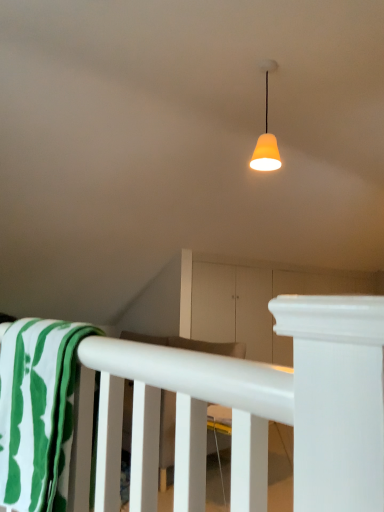
Question: Is white matte rail at lower center positioned behind green striped fabric at lower left?

Choices:
 (A) no
 (B) yes

Answer: (B)

Question: Considering the relative positions of white matte rail at lower center and green striped fabric at lower left in the image provided, is white matte rail at lower center to the left of green striped fabric at lower left from the viewer's perspective?

Choices:
 (A) no
 (B) yes

Answer: (A)

Question: Is white matte rail at lower center closer to camera compared to green striped fabric at lower left?

Choices:
 (A) no
 (B) yes

Answer: (A)

Question: From the image's perspective, is white matte rail at lower center on green striped fabric at lower left?

Choices:
 (A) no
 (B) yes

Answer: (A)

Question: Can you confirm if white matte rail at lower center is bigger than green striped fabric at lower left?

Choices:
 (A) no
 (B) yes

Answer: (B)

Question: Considering the positions of matte orange lampshade at upper center and green striped fabric at lower left in the image, is matte orange lampshade at upper center bigger or smaller than green striped fabric at lower left?

Choices:
 (A) small
 (B) big

Answer: (A)

Question: Relative to green striped fabric at lower left, is matte orange lampshade at upper center in front or behind?

Choices:
 (A) behind
 (B) front

Answer: (A)

Question: Is point (276, 155) closer or farther from the camera than point (49, 449)?

Choices:
 (A) farther
 (B) closer

Answer: (A)

Question: From a real-world perspective, is matte orange lampshade at upper center physically located above or below green striped fabric at lower left?

Choices:
 (A) above
 (B) below

Answer: (A)

Question: Is white matte rail at lower center wider or thinner than matte orange lampshade at upper center?

Choices:
 (A) wide
 (B) thin

Answer: (A)

Question: In the image, is white matte rail at lower center positioned in front of or behind matte orange lampshade at upper center?

Choices:
 (A) front
 (B) behind

Answer: (A)

Question: From their relative heights in the image, would you say white matte rail at lower center is taller or shorter than matte orange lampshade at upper center?

Choices:
 (A) tall
 (B) short

Answer: (B)

Question: Considering the positions of point (155, 476) and point (268, 143), is point (155, 476) closer or farther from the camera than point (268, 143)?

Choices:
 (A) closer
 (B) farther

Answer: (A)

Question: Is green striped fabric at lower left taller or shorter than white matte rail at lower center?

Choices:
 (A) tall
 (B) short

Answer: (A)

Question: Considering the positions of green striped fabric at lower left and white matte rail at lower center in the image, is green striped fabric at lower left bigger or smaller than white matte rail at lower center?

Choices:
 (A) small
 (B) big

Answer: (A)